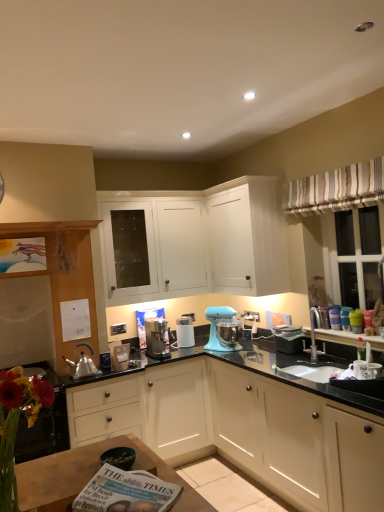
Question: Does wooden table at lower left have a lesser width compared to striped fabric curtain at upper right?

Choices:
 (A) no
 (B) yes

Answer: (A)

Question: Does wooden table at lower left have a greater height compared to striped fabric curtain at upper right?

Choices:
 (A) no
 (B) yes

Answer: (A)

Question: Can you confirm if wooden table at lower left is bigger than striped fabric curtain at upper right?

Choices:
 (A) no
 (B) yes

Answer: (A)

Question: Does wooden table at lower left appear on the left side of striped fabric curtain at upper right?

Choices:
 (A) yes
 (B) no

Answer: (A)

Question: Is wooden table at lower left facing towards striped fabric curtain at upper right?

Choices:
 (A) no
 (B) yes

Answer: (A)

Question: Considering the relative sizes of wooden table at lower left and striped fabric curtain at upper right in the image provided, is wooden table at lower left wider than striped fabric curtain at upper right?

Choices:
 (A) yes
 (B) no

Answer: (A)

Question: Is wooden table at lower left looking in the opposite direction of matte white cabinet at left, arranged as the second cabinetry when ordered from the bottom?

Choices:
 (A) yes
 (B) no

Answer: (A)

Question: Can you confirm if wooden table at lower left is bigger than matte white cabinet at left, arranged as the second cabinetry when ordered from the bottom?

Choices:
 (A) no
 (B) yes

Answer: (A)

Question: Does wooden table at lower left have a greater width compared to matte white cabinet at left, the 3th cabinetry in the top-to-bottom sequence?

Choices:
 (A) yes
 (B) no

Answer: (A)

Question: Is wooden table at lower left outside matte white cabinet at left, arranged as the second cabinetry when ordered from the bottom?

Choices:
 (A) no
 (B) yes

Answer: (B)

Question: From a real-world perspective, is wooden table at lower left on top of matte white cabinet at left, arranged as the second cabinetry when ordered from the bottom?

Choices:
 (A) yes
 (B) no

Answer: (B)

Question: Would you say matte white cabinet at left, the 3th cabinetry in the top-to-bottom sequence, is part of wooden table at lower left's contents?

Choices:
 (A) yes
 (B) no

Answer: (B)

Question: Is there a large distance between striped fabric curtain at upper right and matte white cabinet at left, arranged as the second cabinetry when ordered from the bottom?

Choices:
 (A) no
 (B) yes

Answer: (B)